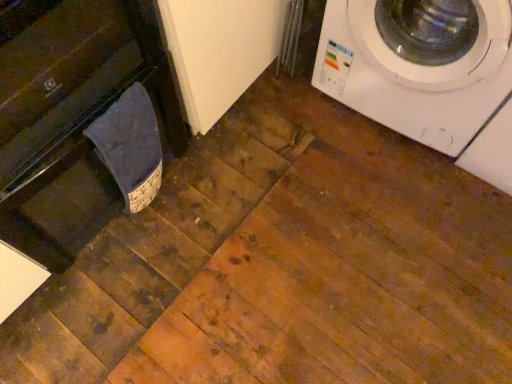
Question: Should I look upward or downward to see black glossy dishwasher at left?

Choices:
 (A) down
 (B) up

Answer: (B)

Question: Does black glossy dishwasher at left have a lesser width compared to dark blue fabric at lower left?

Choices:
 (A) no
 (B) yes

Answer: (A)

Question: Considering the relative sizes of black glossy dishwasher at left and dark blue fabric at lower left in the image provided, is black glossy dishwasher at left wider than dark blue fabric at lower left?

Choices:
 (A) yes
 (B) no

Answer: (A)

Question: Is black glossy dishwasher at left at the right side of dark blue fabric at lower left?

Choices:
 (A) no
 (B) yes

Answer: (A)

Question: From a real-world perspective, is black glossy dishwasher at left located higher than dark blue fabric at lower left?

Choices:
 (A) no
 (B) yes

Answer: (B)

Question: Could dark blue fabric at lower left be considered to be inside black glossy dishwasher at left?

Choices:
 (A) no
 (B) yes

Answer: (B)

Question: Is black glossy dishwasher at left oriented away from dark blue fabric at lower left?

Choices:
 (A) yes
 (B) no

Answer: (B)

Question: Considering the relative sizes of white glossy washing machine at upper right and dark blue fabric at lower left in the image provided, is white glossy washing machine at upper right bigger than dark blue fabric at lower left?

Choices:
 (A) yes
 (B) no

Answer: (A)

Question: Is white glossy washing machine at upper right wider than dark blue fabric at lower left?

Choices:
 (A) no
 (B) yes

Answer: (B)

Question: From the image's perspective, is white glossy washing machine at upper right above dark blue fabric at lower left?

Choices:
 (A) yes
 (B) no

Answer: (A)

Question: From a real-world perspective, is white glossy washing machine at upper right under dark blue fabric at lower left?

Choices:
 (A) no
 (B) yes

Answer: (A)

Question: From the image's perspective, is white glossy washing machine at upper right under dark blue fabric at lower left?

Choices:
 (A) no
 (B) yes

Answer: (A)

Question: Is white glossy washing machine at upper right positioned in front of dark blue fabric at lower left?

Choices:
 (A) yes
 (B) no

Answer: (A)

Question: Is the position of white glossy washing machine at upper right less distant than that of black glossy dishwasher at left?

Choices:
 (A) yes
 (B) no

Answer: (B)